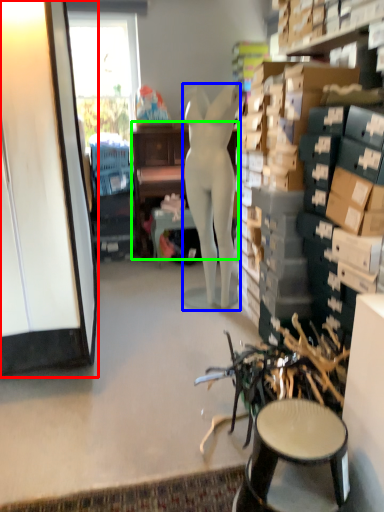
Question: Based on their relative distances, which object is farther from cabinetry (highlighted by a red box)? Choose from person (highlighted by a blue box) and desk (highlighted by a green box).

Choices:
 (A) person
 (B) desk

Answer: (B)